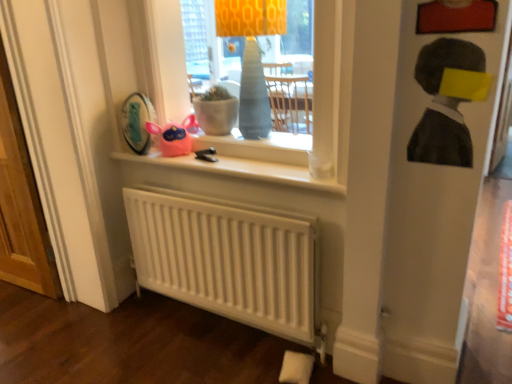
The height and width of the screenshot is (384, 512). I want to click on free space to the left of white matte radiator at lower center, so click(151, 337).